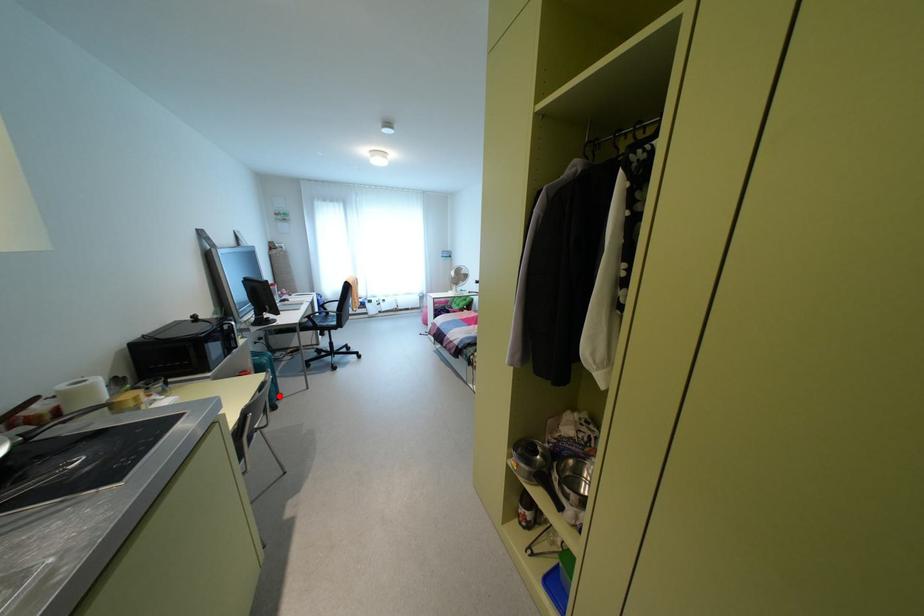
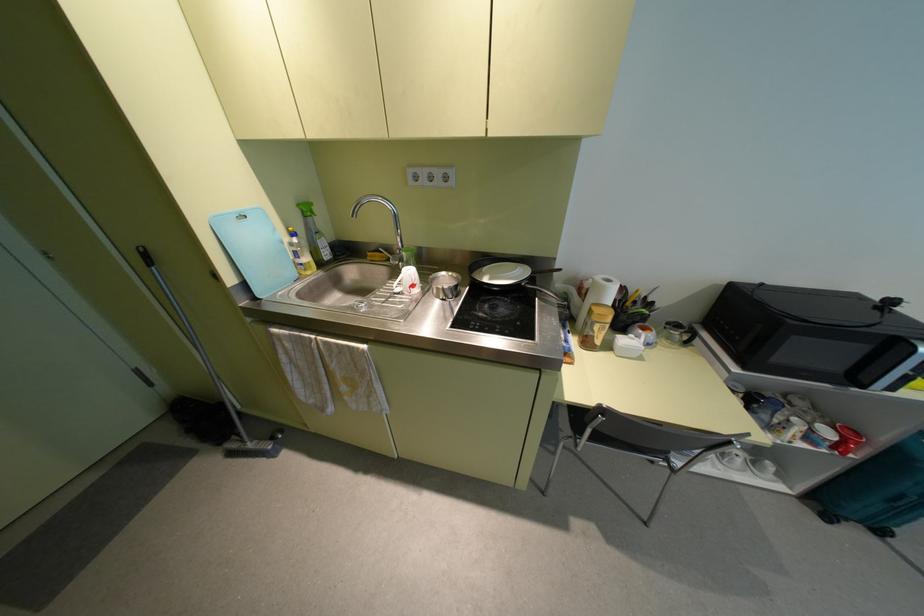
Where in the second image is the point corresponding to the highlighted location from the first image?

(880, 531)